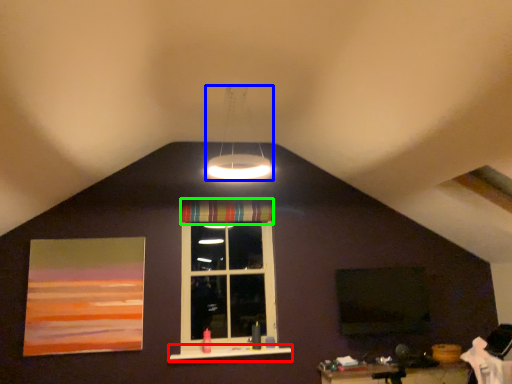
Question: Based on their relative distances, which object is nearer to window sill (highlighted by a red box)? Choose from lamp (highlighted by a blue box) and curtain (highlighted by a green box).

Choices:
 (A) lamp
 (B) curtain

Answer: (B)